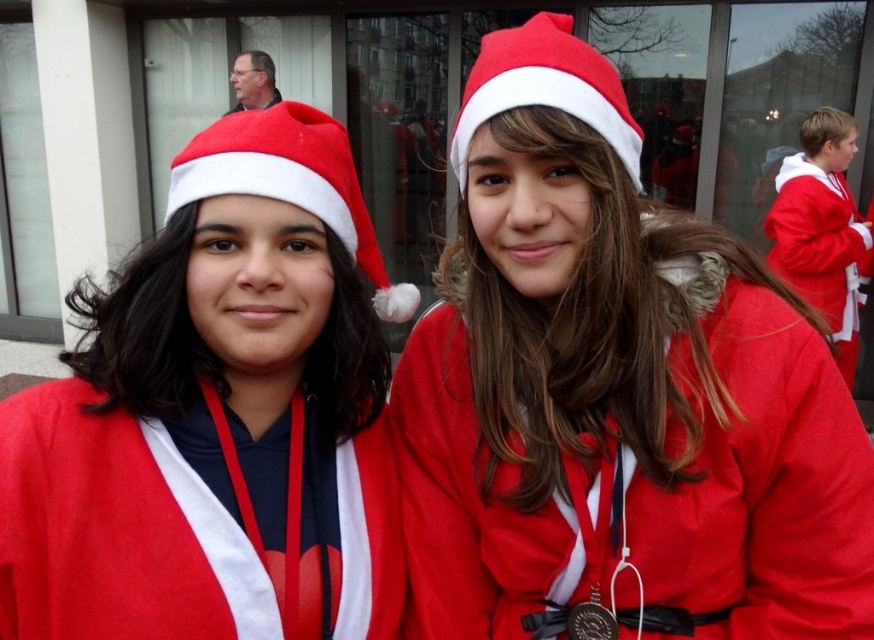
Between matte red coat at center and matte fabric santa hat at center, which one is positioned higher?

matte fabric santa hat at center is higher up.

Does matte red coat at center appear under matte fabric santa hat at center?

Indeed, matte red coat at center is positioned under matte fabric santa hat at center.

Between point (560, 173) and point (595, 67), which one is positioned behind?

Positioned behind is point (595, 67).

At what (x,y) coordinates should I click in order to perform the action: click on matte red coat at center. Please return your answer as a coordinate pair (x, y). Image resolution: width=874 pixels, height=640 pixels. Looking at the image, I should click on (615, 394).

Does matte red santa hat at center come in front of matte fabric santa hat at center?

No, it is not.

Can you confirm if matte red santa hat at center is positioned to the left of matte fabric santa hat at center?

Correct, you'll find matte red santa hat at center to the left of matte fabric santa hat at center.

Does point (216, 140) lie behind point (569, 19)?

That is False.

At what (x,y) coordinates should I click in order to perform the action: click on matte red santa hat at center. Please return your answer as a coordinate pair (x, y). Image resolution: width=874 pixels, height=640 pixels. Looking at the image, I should click on (290, 180).

You are a GUI agent. You are given a task and a screenshot of the screen. Output one action in this format:
    pyautogui.click(x=<x>, y=<y>)
    Task: Click on the matte red santa hat at left
    The image size is (874, 640).
    Given the screenshot: What is the action you would take?
    pyautogui.click(x=209, y=413)

Which of these two, matte red santa hat at left or matte fabric santa hat at center, stands shorter?

Standing shorter between the two is matte fabric santa hat at center.

Which is behind, point (330, 522) or point (532, 65)?

The point (330, 522) is more distant.

What are the coordinates of `matte red santa hat at left` in the screenshot? It's located at (209, 413).